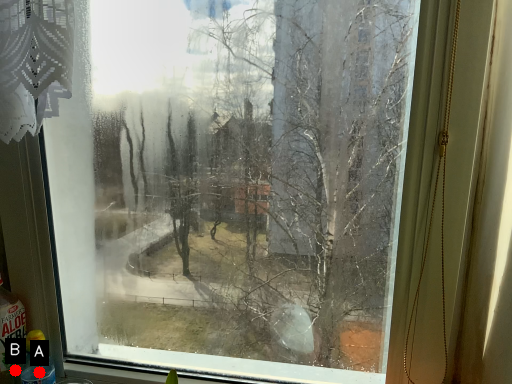
Question: Two points are circled on the image, labeled by A and B beside each circle. Which of the following is the farthest from the observer?

Choices:
 (A) A is further
 (B) B is further

Answer: (B)